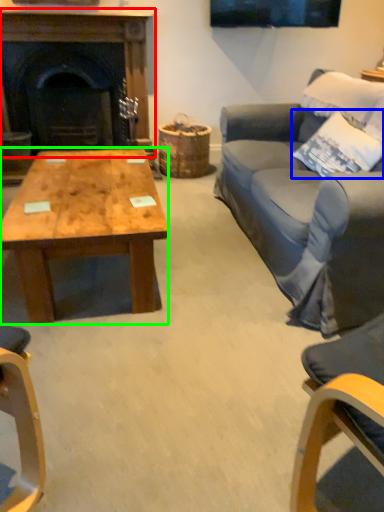
Question: Based on their relative distances, which object is nearer to fireplace (highlighted by a red box)? Choose from pillow (highlighted by a blue box) and coffee table (highlighted by a green box).

Choices:
 (A) pillow
 (B) coffee table

Answer: (B)